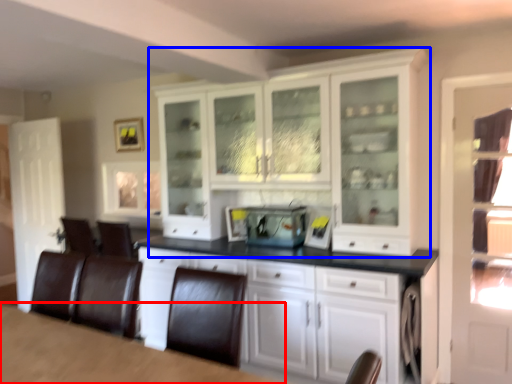
Question: Which of the following is the farthest to the observer, table (highlighted by a red box) or cabinetry (highlighted by a blue box)?

Choices:
 (A) table
 (B) cabinetry

Answer: (B)